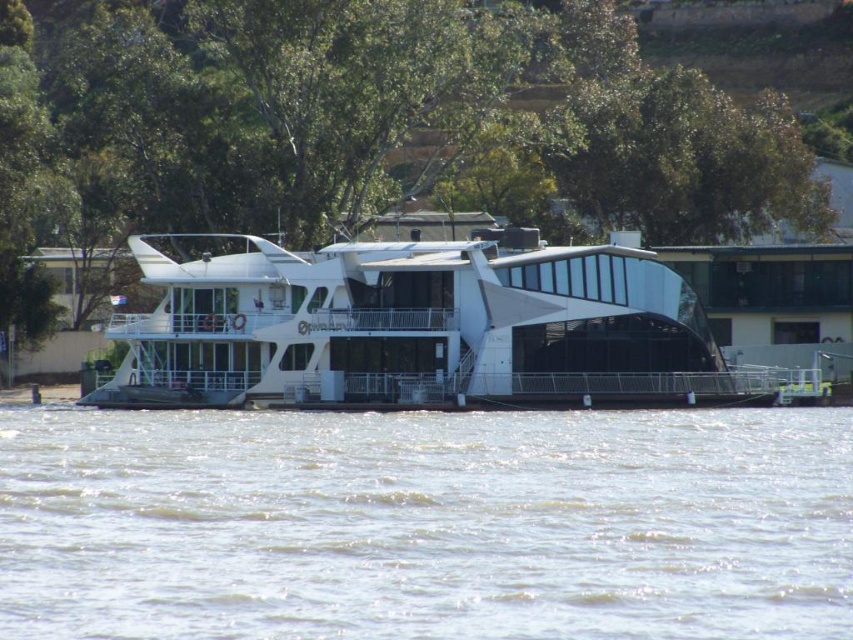
Question: Does clear water at lower center appear on the right side of white glossy boat at center?

Choices:
 (A) no
 (B) yes

Answer: (B)

Question: Does clear water at lower center appear over white glossy boat at center?

Choices:
 (A) yes
 (B) no

Answer: (B)

Question: Is clear water at lower center positioned behind white glossy boat at center?

Choices:
 (A) yes
 (B) no

Answer: (B)

Question: Among these points, which one is nearest to the camera?

Choices:
 (A) (601, 416)
 (B) (390, 298)

Answer: (A)